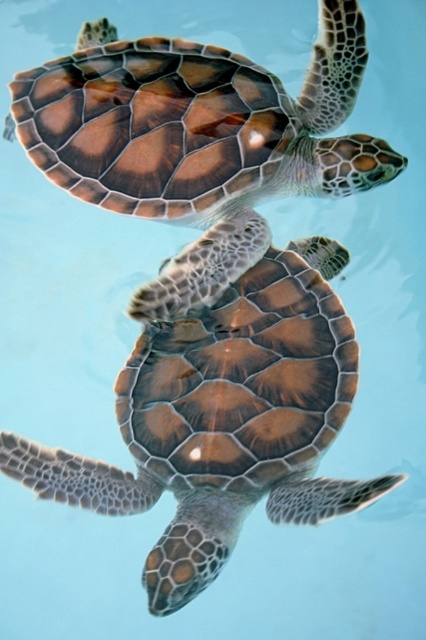
Question: Which of the following is the farthest from the observer?

Choices:
 (A) brown textured shell at upper center
 (B) brown textured shell at center

Answer: (A)

Question: Does brown textured shell at center appear over brown textured shell at upper center?

Choices:
 (A) no
 (B) yes

Answer: (A)

Question: Among these objects, which one is nearest to the camera?

Choices:
 (A) brown textured shell at center
 (B) brown textured shell at upper center

Answer: (A)

Question: Which object appears closest to the camera in this image?

Choices:
 (A) brown textured shell at center
 (B) brown textured shell at upper center

Answer: (A)

Question: Can you confirm if brown textured shell at center is positioned below brown textured shell at upper center?

Choices:
 (A) no
 (B) yes

Answer: (B)

Question: From the image, what is the correct spatial relationship of brown textured shell at center in relation to brown textured shell at upper center?

Choices:
 (A) right
 (B) left

Answer: (A)